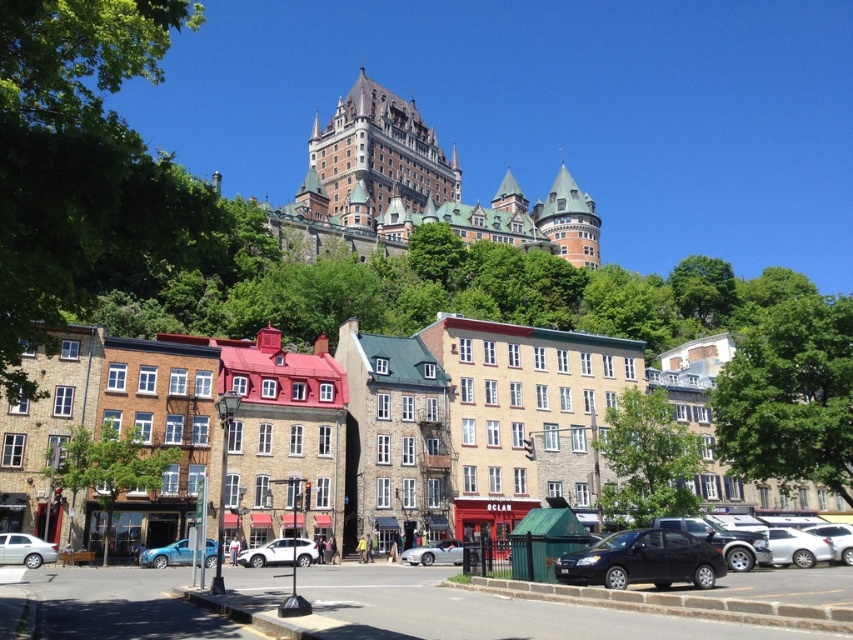
Question: Can you confirm if black matte sedan at lower right is positioned below white glossy sedan at lower right?

Choices:
 (A) no
 (B) yes

Answer: (A)

Question: Is silver metallic sedan at lower left below silver metallic convertible at center?

Choices:
 (A) yes
 (B) no

Answer: (B)

Question: Does brown stone castle at upper center have a smaller size compared to silver metallic sedan at lower left?

Choices:
 (A) no
 (B) yes

Answer: (A)

Question: Based on their relative distances, which object is farther from the white glossy sedan at lower right?

Choices:
 (A) matte black sedan at lower right
 (B) brown stone castle at upper center
 (C) green leafy tree at upper left
 (D) reddish-brown stone castle at upper center

Answer: (B)

Question: Which object is positioned closest to the green leafy tree at upper left?

Choices:
 (A) white glossy sedan at lower right
 (B) silver metallic convertible at center
 (C) green leafy tree at upper right
 (D) matte black sedan at lower right

Answer: (B)

Question: Considering the real-world distances, which object is farthest from the silver metallic sedan at lower left?

Choices:
 (A) green leafy tree at center
 (B) reddish-brown stone castle at upper center
 (C) stone buildings at center

Answer: (B)